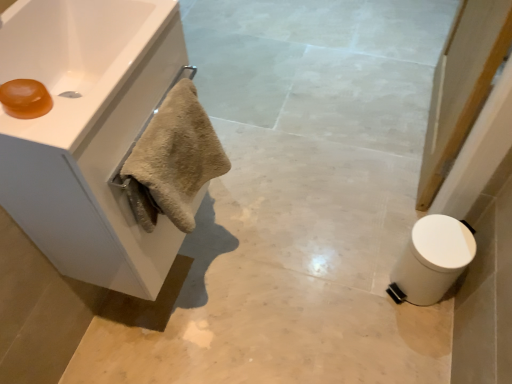
In order to click on vacant area that is in front of white matte cabinet at upper left in this screenshot , I will do `click(161, 349)`.